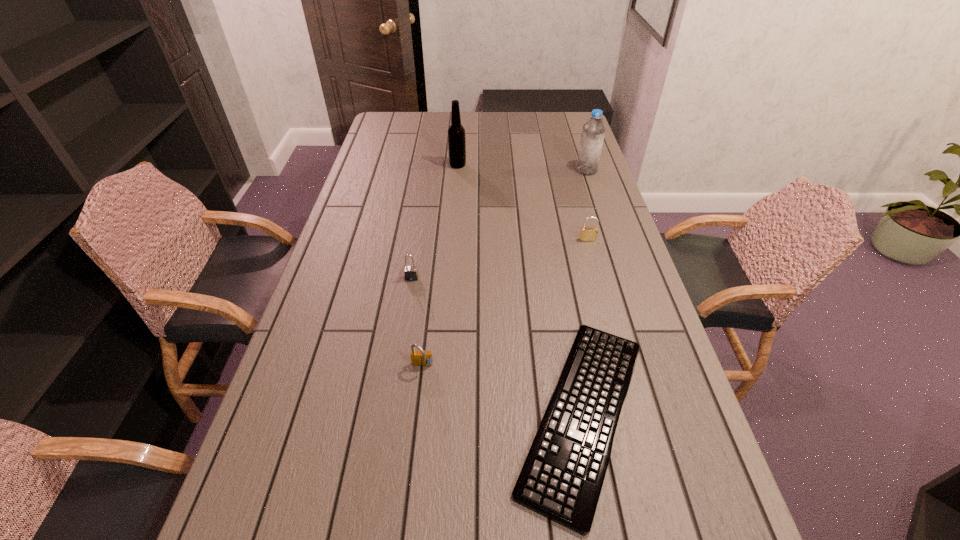
In order to click on vacant space located 0.350m on the front-facing side of the farthest padlock in this screenshot , I will do `click(612, 327)`.

Locate an element on the screen. This screenshot has width=960, height=540. vacant position located 0.110m on the shackle of the second farthest padlock is located at coordinates (407, 309).

The height and width of the screenshot is (540, 960). In order to click on vacant point located 0.060m on the side with the combination dials of the second padlock from left to right in this screenshot , I will do `click(420, 394)`.

Where is `vacant space located on the left of the computer keyboard`? The height and width of the screenshot is (540, 960). vacant space located on the left of the computer keyboard is located at coordinates (380, 413).

The image size is (960, 540). What are the coordinates of `water bottle that is at the right edge` in the screenshot? It's located at (593, 131).

Where is `padlock located at the right edge`? This screenshot has height=540, width=960. padlock located at the right edge is located at coordinates point(586,233).

The width and height of the screenshot is (960, 540). I want to click on computer keyboard present at the right edge, so click(561, 479).

In the image, there is a desktop. Identify the location of vacant space at the far edge. (462, 123).

Find the location of a particular element. vacant position at the left edge of the desktop is located at coordinates (315, 299).

Find the location of a particular element. The height and width of the screenshot is (540, 960). vacant space at the right edge of the desktop is located at coordinates (578, 139).